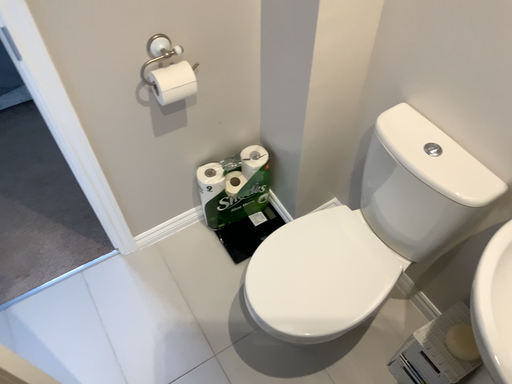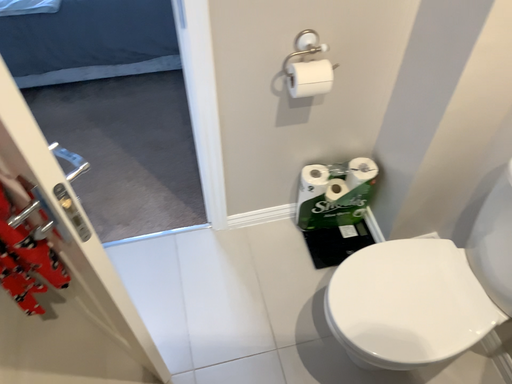
Question: Which way did the camera rotate in the video?

Choices:
 (A) rotated left
 (B) rotated right

Answer: (A)